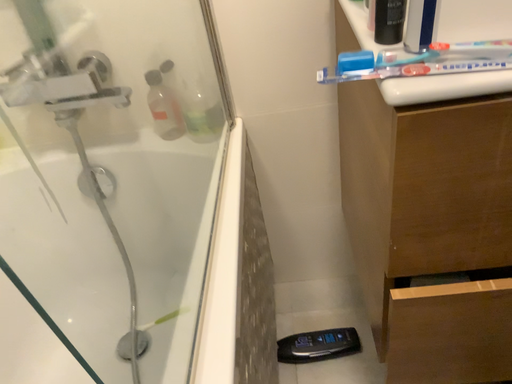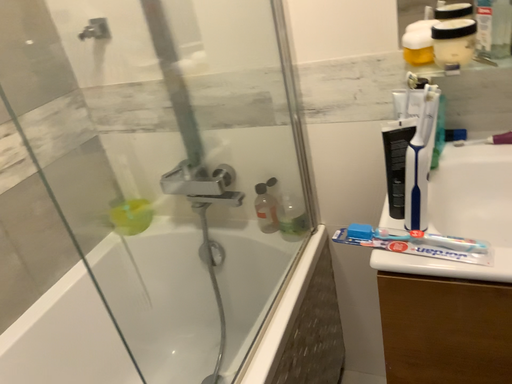
Question: Which way did the camera rotate in the video?

Choices:
 (A) rotated upward
 (B) rotated downward

Answer: (A)